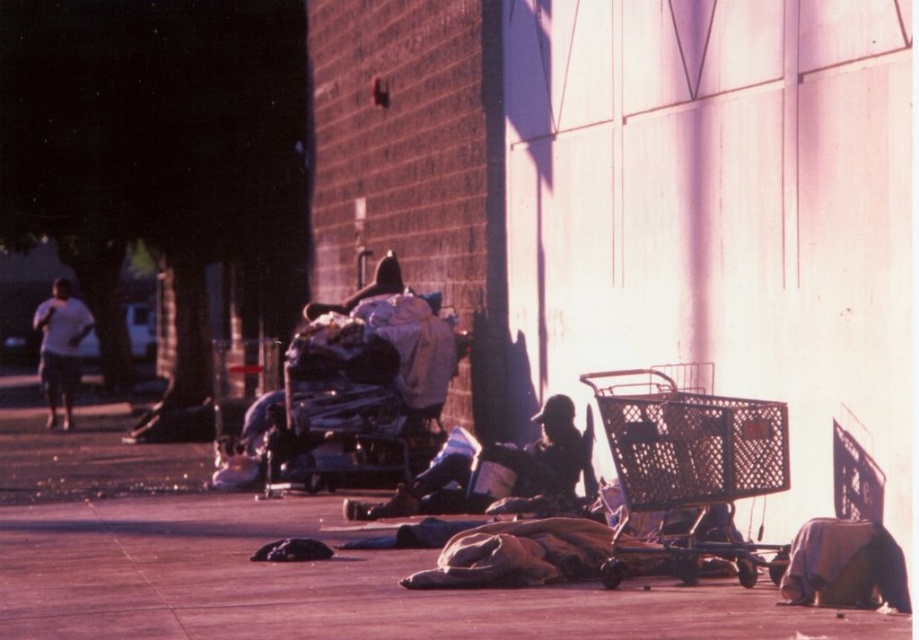
You are a delivery person who needs to place a heavy box on the ground. You see the smooth concrete pavement at lower center and the metallic silver shopping cart at lower right. Which surface can you use to place the box without it getting damaged?

The smooth concrete pavement at lower center is positioned under metallic silver shopping cart at lower right, so you can place the box on the smooth concrete pavement at lower center since it is a stable surface beneath the cart.

You are a delivery person who needs to place a package on the ground near the white cotton shirt at left. Based on the scene, where should you place it to ensure it stays on the smooth concrete pavement at lower center?

You should place the package to the right of the white cotton shirt at left, as the smooth concrete pavement at lower center is located to the right of it.

You are a delivery person who needs to place a package on the ground between the dark skin person at center and the white cotton shirt at left. Can you fit the package there if it requires at least 1 meter of space?

The dark skin person at center is shorter than the white cotton shirt at left, but the description does not provide information about the distance between them. Therefore, it is impossible to determine if there is enough space for the package.